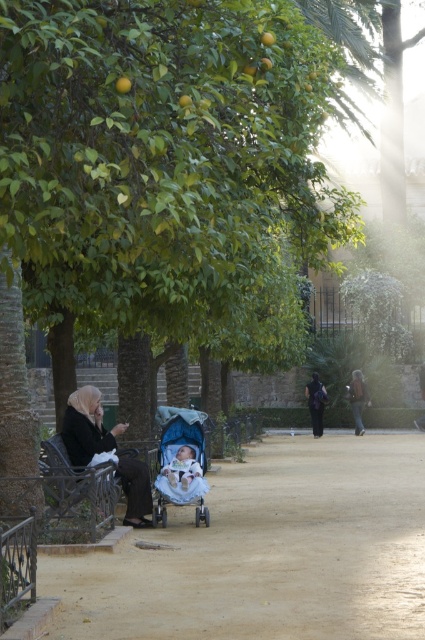
Based on the photo, you are a photographer standing at the end of the pathway. You want to take a photo that includes both the black wrought iron bench at lower left and the black fabric person at center. Which object should be placed closer to the camera to ensure both are in focus?

The black wrought iron bench at lower left has a lesser height compared to the black fabric person at center. To ensure both are in focus, the photographer should place the black wrought iron bench at lower left closer to the camera since it is shorter and needs to be within the depth of field range along with the taller black fabric person at center.

You are a landscape architect designing a new park. You need to place a new bench that is 1.5 meters wide between the black wrought iron bench at lower left and the black fabric person at center. Can you fit the new bench between them without overlapping either object?

The black wrought iron bench at lower left is wider than the black fabric person at center. Since the new bench is 1.5 meters wide, you need to check the available space between them. However, the exact distance between the two objects isn not provided in the description. Without knowing the distance, it is impossible to determine if the new bench will fit.